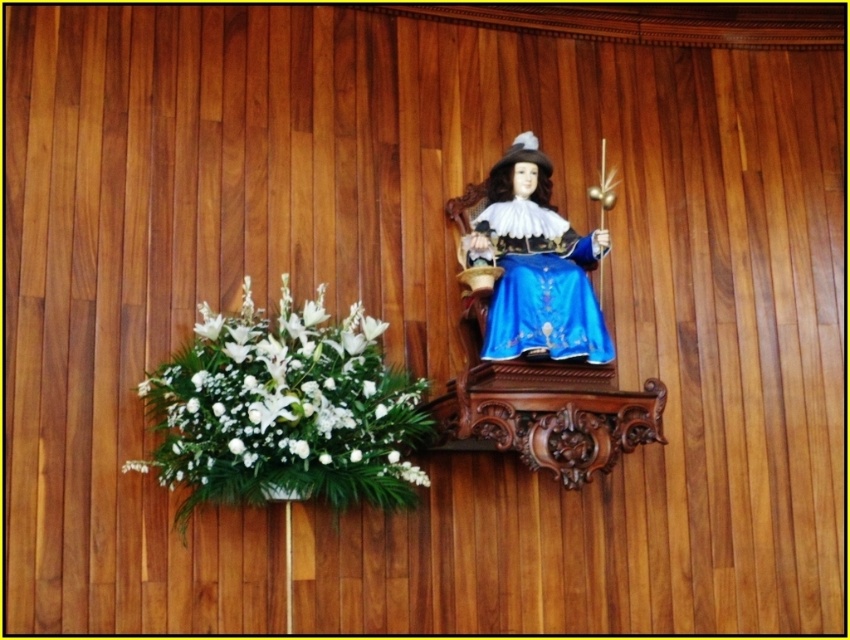
You are standing in front of a wooden wall with a carved shelf on the right and a floral arrangement on the left. You want to place a small vase that is 0.5 meters tall on the white matte floral arrangement at lower left. Can the vase fit on the arrangement without falling off?

The white matte floral arrangement at lower left is 3.28 meters away from the viewer. However, the height of the arrangement is not provided, so it is unclear if the 0.5 meters tall vase will fit without falling off. More information about the arrangement height is needed.

You are an interior designer assessing the layout of the wooden wall. You need to determine if the white matte floral arrangement at lower left can be moved to the space currently occupied by the blue satin dress at center. Based on their widths, is this possible?

The white matte floral arrangement at lower left might be wider than blue satin dress at center, so it may not fit in the space if the current space is sized for the dress. Check the exact measurements before moving.

You are an interior designer assessing the wall decor. The blue satin dress at center is part of a display, and you need to ensure it doesn not fall onto the white matte floral arrangement at lower left. Based on their positions, is the dress above or below the flowers?

The white matte floral arrangement at lower left is positioned under the blue satin dress at center, so the dress is above the flowers.